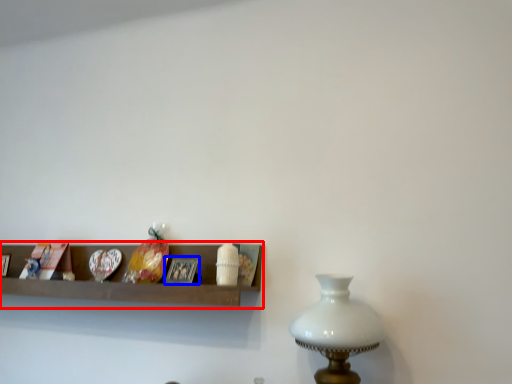
Question: Which of the following is the farthest to the observer, shelf (highlighted by a red box) or picture frame (highlighted by a blue box)?

Choices:
 (A) shelf
 (B) picture frame

Answer: (B)